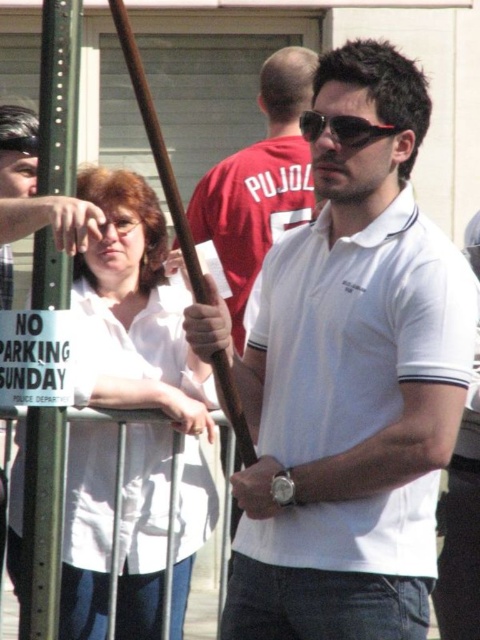
Question: Which point is closer to the camera?

Choices:
 (A) (x=352, y=138)
 (B) (x=49, y=292)

Answer: (B)

Question: Is green metallic pole at left to the right of sunglasses at center from the viewer's perspective?

Choices:
 (A) yes
 (B) no

Answer: (B)

Question: Which point is closer to the camera taking this photo?

Choices:
 (A) (347, 141)
 (B) (59, 132)

Answer: (B)

Question: Which point is farther to the camera?

Choices:
 (A) (24, 547)
 (B) (369, 129)

Answer: (A)

Question: In this image, where is white cotton polo shirt at center located relative to sunglasses at center?

Choices:
 (A) right
 (B) left

Answer: (A)

Question: Is white cotton polo shirt at center wider than sunglasses at center?

Choices:
 (A) yes
 (B) no

Answer: (B)